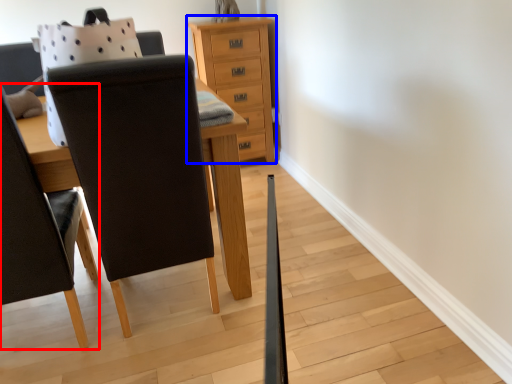
Question: Among these objects, which one is nearest to the camera, chair (highlighted by a red box) or chest of drawers (highlighted by a blue box)?

Choices:
 (A) chair
 (B) chest of drawers

Answer: (A)